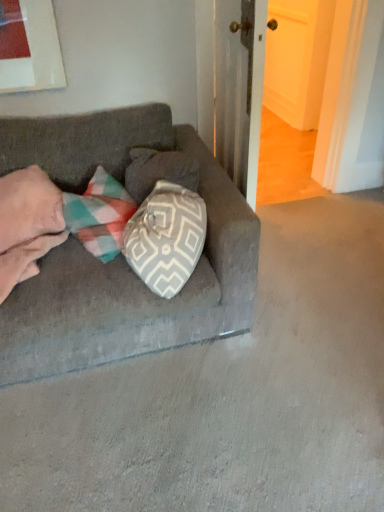
Question: Is velvet gray couch at center inside the boundaries of pink soft blanket at left, or outside?

Choices:
 (A) inside
 (B) outside

Answer: (B)

Question: Considering the positions of velvet gray couch at center and pink soft blanket at left in the image, is velvet gray couch at center wider or thinner than pink soft blanket at left?

Choices:
 (A) thin
 (B) wide

Answer: (B)

Question: From their relative heights in the image, would you say velvet gray couch at center is taller or shorter than pink soft blanket at left?

Choices:
 (A) short
 (B) tall

Answer: (B)

Question: Is pink soft blanket at left in front of or behind velvet gray couch at center in the image?

Choices:
 (A) behind
 (B) front

Answer: (A)

Question: Considering the positions of pink soft blanket at left and velvet gray couch at center in the image, is pink soft blanket at left wider or thinner than velvet gray couch at center?

Choices:
 (A) thin
 (B) wide

Answer: (A)

Question: Is pink soft blanket at left taller or shorter than velvet gray couch at center?

Choices:
 (A) short
 (B) tall

Answer: (A)

Question: From a real-world perspective, is pink soft blanket at left above or below velvet gray couch at center?

Choices:
 (A) above
 (B) below

Answer: (A)